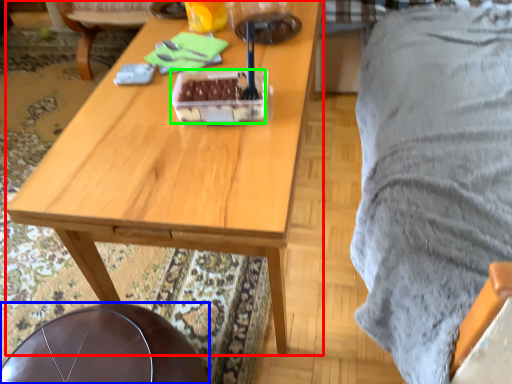
Question: Which is farther away from desk (highlighted by a red box)? chair (highlighted by a blue box) or food (highlighted by a green box)?

Choices:
 (A) chair
 (B) food

Answer: (A)